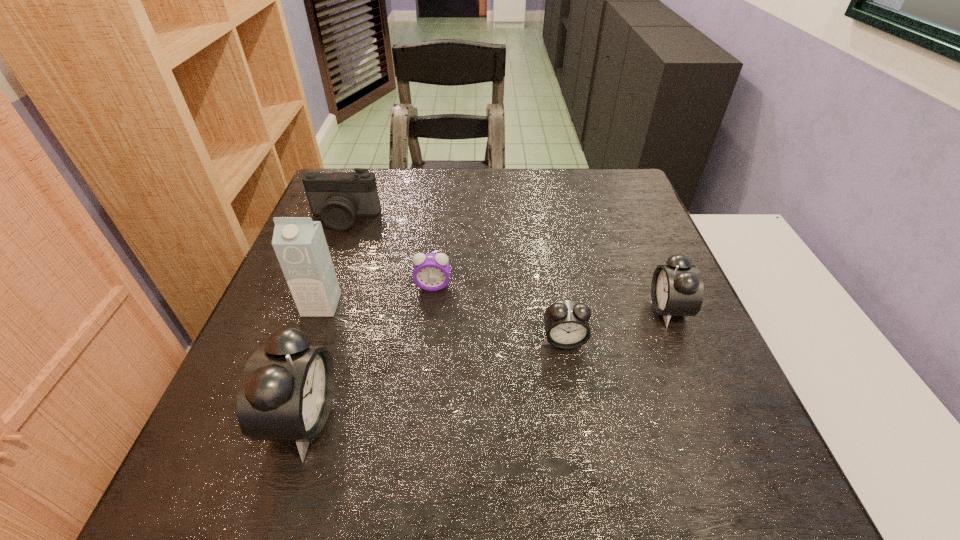
Please point a space for a new alarm_clock to maintain equal intervals. Please provide its 2D coordinates. Your answer should be formatted as a tuple, i.e. [(x, y)], where the tuple contains the x and y coordinates of a point satisfying the conditions above.

[(444, 376)]